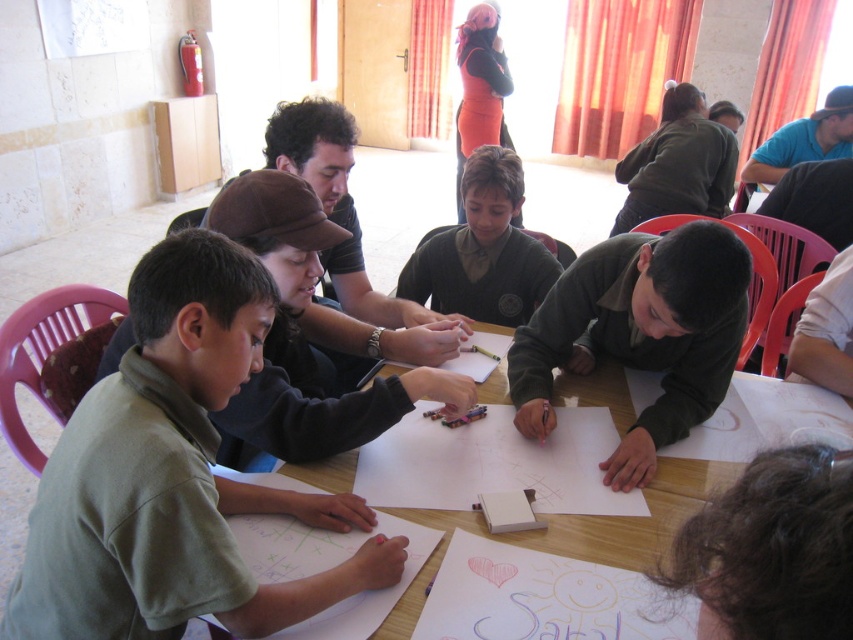
Question: Observing the image, what is the correct spatial positioning of green matte shirt at center in reference to dark green sweater at center?

Choices:
 (A) left
 (B) right

Answer: (A)

Question: Among these points, which one is farthest from the camera?

Choices:
 (A) (753, 156)
 (B) (339, 145)

Answer: (A)

Question: Based on their relative distances, which object is farther from the matte black shirt at upper center?

Choices:
 (A) dark green sweater at center
 (B) wooden table at center
 (C) blue shirt at upper right
 (D) green matte shirt at center

Answer: (C)

Question: Which point is closer to the camera?

Choices:
 (A) wooden table at center
 (B) blue shirt at upper right
 (C) green matte shirt at center

Answer: (C)

Question: Considering the relative positions of matte black shirt at upper center and wooden table at center in the image provided, where is matte black shirt at upper center located with respect to wooden table at center?

Choices:
 (A) above
 (B) below

Answer: (A)

Question: Is the position of matte black shirt at upper center more distant than that of wooden table at center?

Choices:
 (A) no
 (B) yes

Answer: (B)